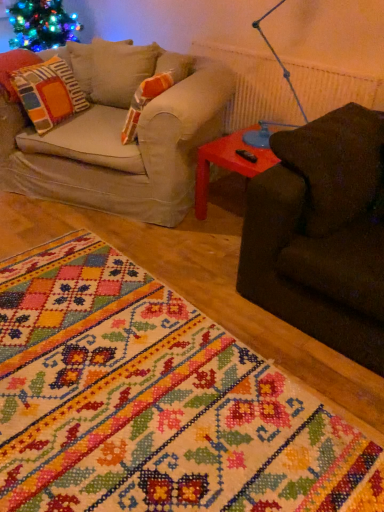
Measure the distance between embroidered fabric rug at lower left and camera.

They are 4.02 feet apart.

The image size is (384, 512). Describe the element at coordinates (48, 93) in the screenshot. I see `multicolored fabric pillow at left` at that location.

The width and height of the screenshot is (384, 512). What do you see at coordinates (232, 160) in the screenshot?
I see `rubberized plastic side table at right` at bounding box center [232, 160].

Where is `embroidered fabric rug at lower left`? This screenshot has width=384, height=512. embroidered fabric rug at lower left is located at coordinates (154, 401).

From the image's perspective, is multicolored fabric pillow at left below embroidered fabric rug at lower left?

No, from the image's perspective, multicolored fabric pillow at left is not below embroidered fabric rug at lower left.

Is multicolored fabric pillow at left in front of or behind embroidered fabric rug at lower left in the image?

In the image, multicolored fabric pillow at left appears behind embroidered fabric rug at lower left.

This screenshot has width=384, height=512. I want to click on blanket that appears in front of the multicolored fabric pillow at left, so click(x=154, y=401).

From a real-world perspective, is multicolored fabric pillow at left beneath embroidered fabric rug at lower left?

No.

Measure the distance from rubberized plastic side table at right to multicolored fabric pillow at left.

They are 39.18 inches apart.

From a real-world perspective, is rubberized plastic side table at right above or below multicolored fabric pillow at left?

rubberized plastic side table at right is below multicolored fabric pillow at left.

From the image's perspective, is rubberized plastic side table at right located above or below multicolored fabric pillow at left?

From the image's perspective, rubberized plastic side table at right appears below multicolored fabric pillow at left.

Considering the relative sizes of rubberized plastic side table at right and multicolored fabric pillow at left in the image provided, is rubberized plastic side table at right wider than multicolored fabric pillow at left?

Yes, rubberized plastic side table at right is wider than multicolored fabric pillow at left.

Considering the sizes of objects rubberized plastic side table at right and embroidered fabric rug at lower left in the image provided, who is wider, rubberized plastic side table at right or embroidered fabric rug at lower left?

embroidered fabric rug at lower left is wider.

Is rubberized plastic side table at right to the left or to the right of embroidered fabric rug at lower left in the image?

Based on their positions, rubberized plastic side table at right is located to the right of embroidered fabric rug at lower left.

Which is farther, (273, 159) or (26, 395)?

Positioned behind is point (273, 159).

From a real-world perspective, which object stands above the other?

rubberized plastic side table at right is physically above.

Does embroidered fabric rug at lower left have a smaller size compared to rubberized plastic side table at right?

No.

Is embroidered fabric rug at lower left positioned with its back to rubberized plastic side table at right?

No.

Is the depth of embroidered fabric rug at lower left greater than that of multicolored fabric pillow at left?

No, the depth of embroidered fabric rug at lower left is less than that of multicolored fabric pillow at left.

Is embroidered fabric rug at lower left turned away from multicolored fabric pillow at left?

embroidered fabric rug at lower left is not turned away from multicolored fabric pillow at left.

What are the coordinates of `blanket in front of the multicolored fabric pillow at left` in the screenshot? It's located at (154, 401).

From the image's perspective, would you say embroidered fabric rug at lower left is shown under multicolored fabric pillow at left?

Yes, from the image's perspective, embroidered fabric rug at lower left is beneath multicolored fabric pillow at left.

Who is taller, multicolored fabric pillow at left or rubberized plastic side table at right?

Standing taller between the two is multicolored fabric pillow at left.

Is multicolored fabric pillow at left surrounding rubberized plastic side table at right?

Actually, rubberized plastic side table at right is outside multicolored fabric pillow at left.

Consider the image. From the image's perspective, is multicolored fabric pillow at left over rubberized plastic side table at right?

Yes, from the image's perspective, multicolored fabric pillow at left is above rubberized plastic side table at right.

Identify the location of blanket below the multicolored fabric pillow at left (from a real-world perspective). pos(154,401).

This screenshot has height=512, width=384. In order to click on pillow above the rubberized plastic side table at right (from the image's perspective) in this screenshot , I will do `click(48, 93)`.

Considering their positions, is embroidered fabric rug at lower left positioned further to rubberized plastic side table at right than multicolored fabric pillow at left?

Based on the image, embroidered fabric rug at lower left appears to be further to rubberized plastic side table at right.

Estimate the real-world distances between objects in this image. Which object is closer to embroidered fabric rug at lower left, multicolored fabric pillow at left or rubberized plastic side table at right?

Among the two, rubberized plastic side table at right is located nearer to embroidered fabric rug at lower left.

Looking at the image, which one is located closer to multicolored fabric pillow at left, embroidered fabric rug at lower left or rubberized plastic side table at right?

rubberized plastic side table at right is positioned closer to the anchor multicolored fabric pillow at left.

Estimate the real-world distances between objects in this image. Which object is further from rubberized plastic side table at right, multicolored fabric pillow at left or embroidered fabric rug at lower left?

embroidered fabric rug at lower left lies further to rubberized plastic side table at right than the other object.

Looking at this image, based on their spatial positions, is rubberized plastic side table at right or embroidered fabric rug at lower left further from multicolored fabric pillow at left?

embroidered fabric rug at lower left is positioned further to the anchor multicolored fabric pillow at left.

Looking at the image, which one is located closer to embroidered fabric rug at lower left, rubberized plastic side table at right or multicolored fabric pillow at left?

rubberized plastic side table at right.

Where is `table located between embroidered fabric rug at lower left and multicolored fabric pillow at left in the depth direction`? The image size is (384, 512). table located between embroidered fabric rug at lower left and multicolored fabric pillow at left in the depth direction is located at coordinates (232, 160).